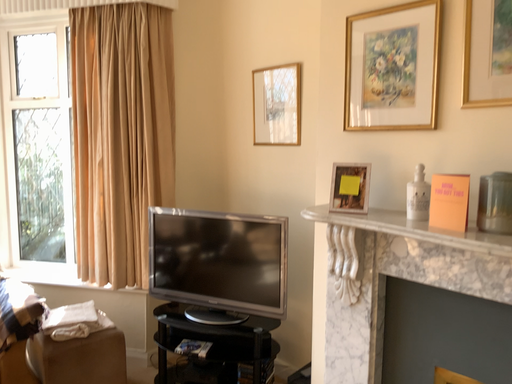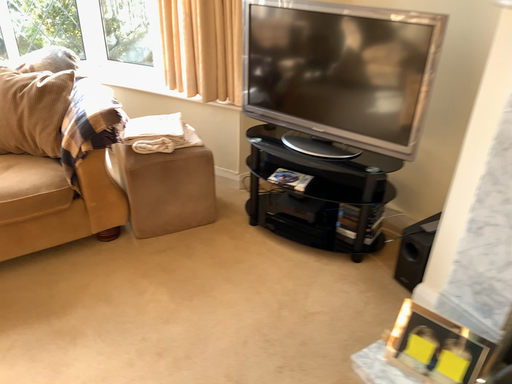
Question: Which way did the camera rotate in the video?

Choices:
 (A) rotated left
 (B) rotated right

Answer: (A)